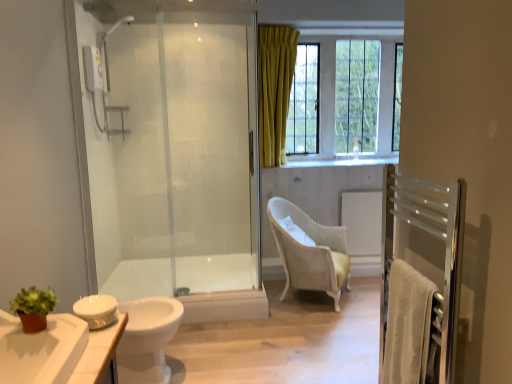
The width and height of the screenshot is (512, 384). What are the coordinates of `blank space situated above white glossy bathtub at center (from a real-world perspective)` in the screenshot? It's located at (188, 264).